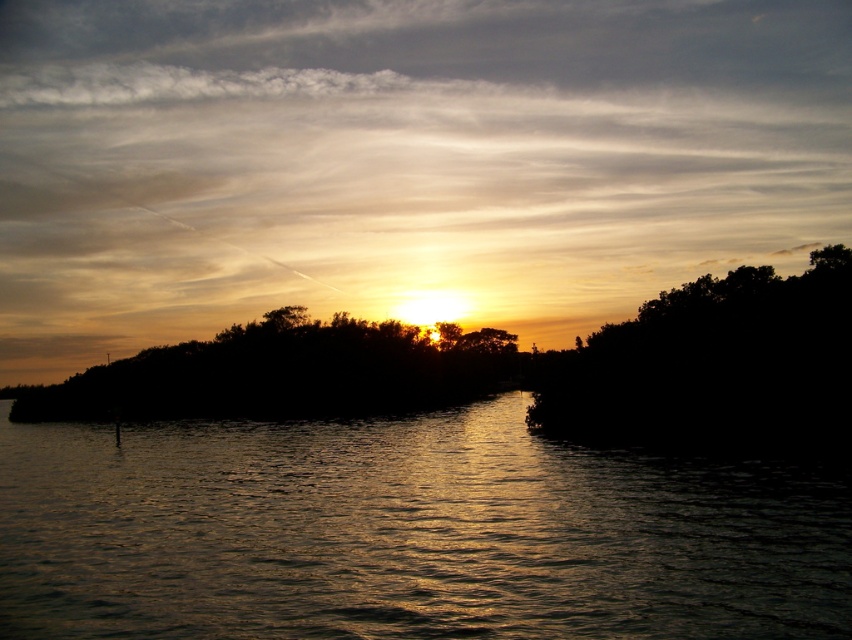
From the picture: You are an artist trying to paint the sunset scene. You want to capture the reflection of the silhouette leafy tree at right in the silvery reflective water at center. Based on the scene, can you confirm if the tree is casting its reflection on the water?

Yes, the silvery reflective water at center is positioned under the silhouette leafy tree at right, so the tree is casting its reflection on the water.

You are standing at the edge of the water and want to walk to the silhouette leafy tree at right without getting your feet wet. The path is 15 meters long. Can you reach the tree without stepping into the silvery reflective water at center?

The silvery reflective water at center is 16.25 meters away from the silhouette leafy tree at right. Since the path is 15 meters long, you cannot reach the tree without stepping into the water because the distance is shorter than the required distance between them.

You are standing at the edge of the water and see two points in the scene. The first is point at point (838, 536) and the second is point at point (743, 404). Which point is closer to you?

Point at point (838, 536) is closer to you than point at point (743, 404) because the Objects Description states that point (838, 536) is closer to the camera than point (743, 404).